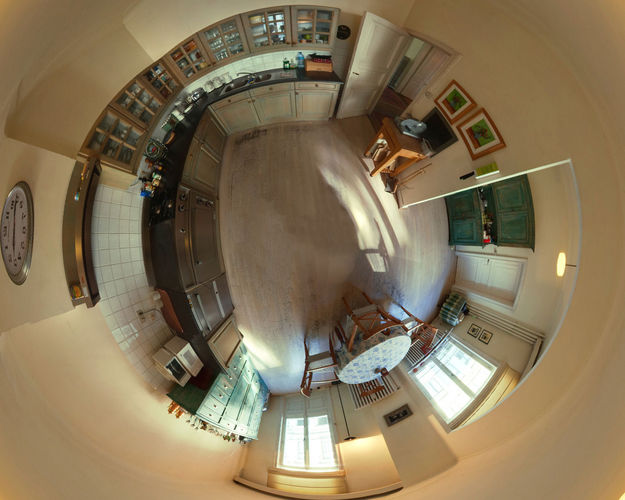
Find the location of `floor`. floor is located at coordinates (318, 247).